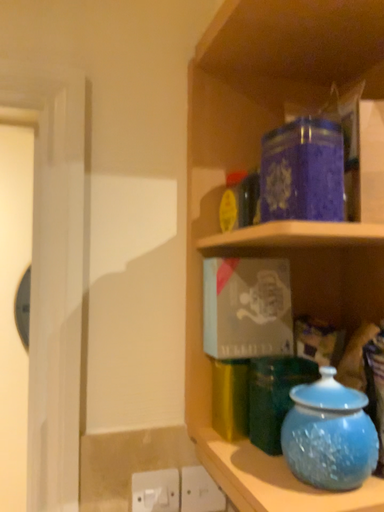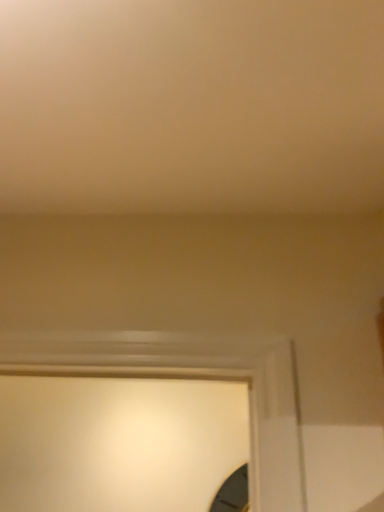
Question: How did the camera likely rotate when shooting the video?

Choices:
 (A) rotated downward
 (B) rotated upward

Answer: (B)